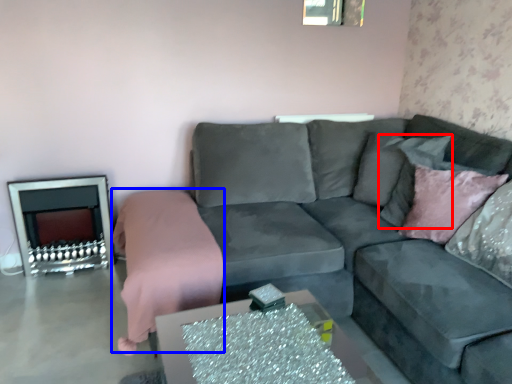
Question: Which point is closer to the camera, pillow (highlighted by a red box) or bedding (highlighted by a blue box)?

Choices:
 (A) pillow
 (B) bedding

Answer: (B)